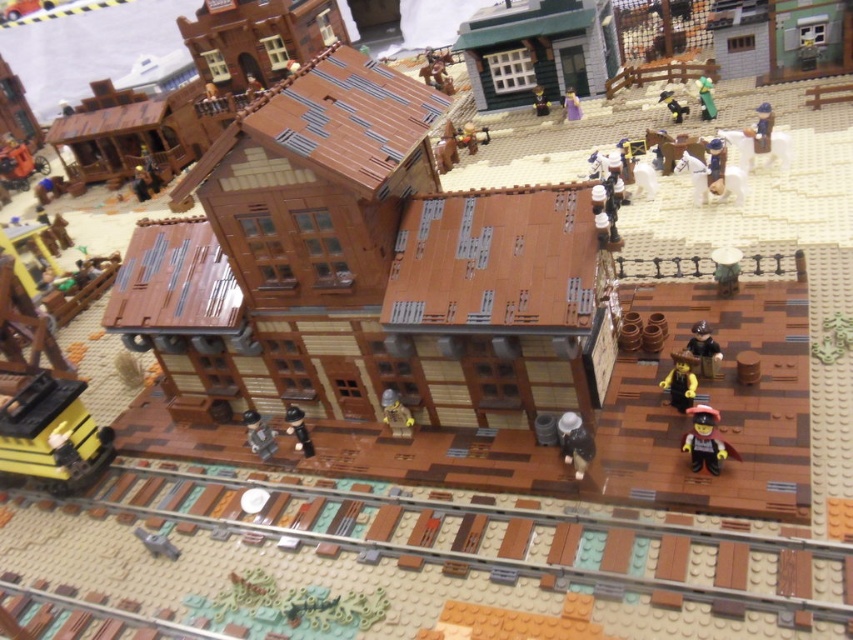
You are a visitor in the Lego town and want to find the smooth black figure at center and the green matte figure at upper right. Which figure is closer to the left edge of the town scene?

The smooth black figure at center is positioned on the left side of green matte figure at upper right, so the smooth black figure at center is closer to the left edge of the town scene.

Looking at this image, you are a Lego builder trying to place the smooth yellow minifigure at center onto the yellow plastic train car at lower left. Can the minifigure fit on the train car without falling off?

The yellow plastic train car at lower left might be wider than smooth yellow minifigure at center, so there is a possibility that the minifigure can fit on the train car without falling off.